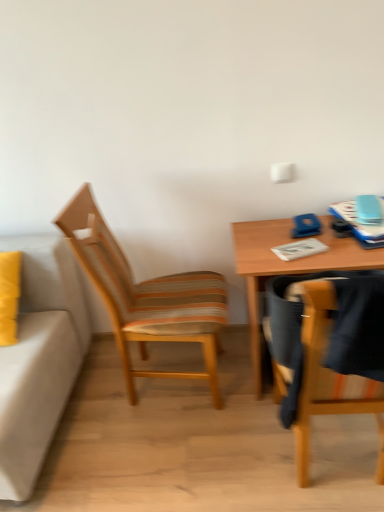
I want to click on unoccupied space behind white paper notepad at center, so click(x=283, y=232).